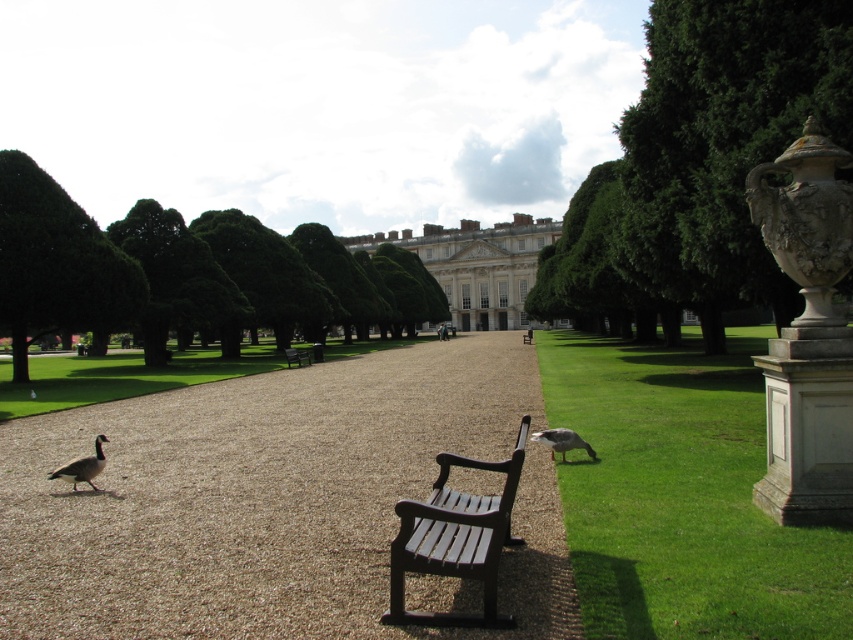
You are a GUI agent. You are given a task and a screenshot of the screen. Output one action in this format:
    pyautogui.click(x=<x>, y=<y>)
    Task: Click on the green grass at center
    
    Given the screenshot: What is the action you would take?
    pyautogui.click(x=120, y=376)

Can you confirm if green grass at center is positioned to the right of brown wooden bench at center?

No, green grass at center is not to the right of brown wooden bench at center.

You are a GUI agent. You are given a task and a screenshot of the screen. Output one action in this format:
    pyautogui.click(x=<x>, y=<y>)
    Task: Click on the green grass at center
    Image resolution: width=853 pixels, height=640 pixels.
    Given the screenshot: What is the action you would take?
    pyautogui.click(x=120, y=376)

From the picture: Who is higher up, black wood bench at center or gray feathered goose at center?

Positioned higher is black wood bench at center.

Is point (495, 589) positioned before point (573, 436)?

Yes, it is in front of point (573, 436).

Locate an element on the screen. This screenshot has width=853, height=640. black wood bench at center is located at coordinates (456, 538).

Does green grass at lower right have a lesser width compared to black wood bench at center?

Incorrect, green grass at lower right's width is not less than black wood bench at center's.

Does green grass at lower right appear over black wood bench at center?

Actually, green grass at lower right is below black wood bench at center.

Which is in front, point (578, 465) or point (502, 621)?

Point (502, 621) is more forward.

At what (x,y) coordinates should I click in order to perform the action: click on green grass at lower right. Please return your answer as a coordinate pair (x, y). This screenshot has height=640, width=853. Looking at the image, I should click on (682, 497).